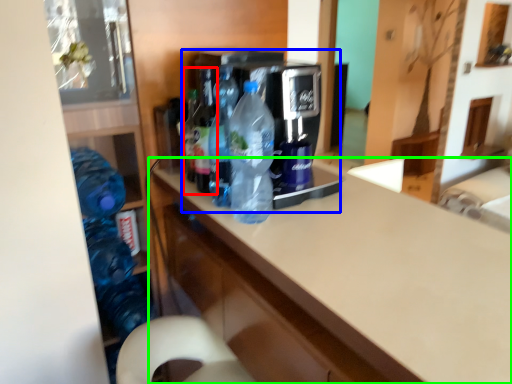
Question: Considering the real-world distances, which object is farthest from bottle (highlighted by a red box)? appliance (highlighted by a blue box) or countertop (highlighted by a green box)?

Choices:
 (A) appliance
 (B) countertop

Answer: (B)